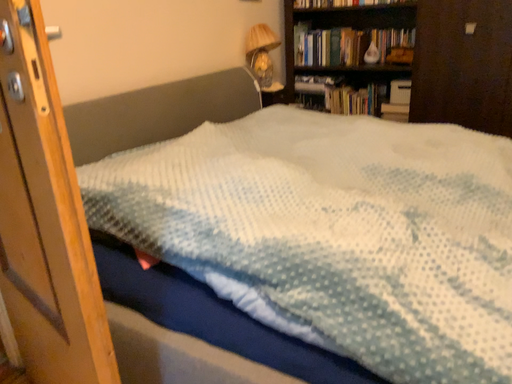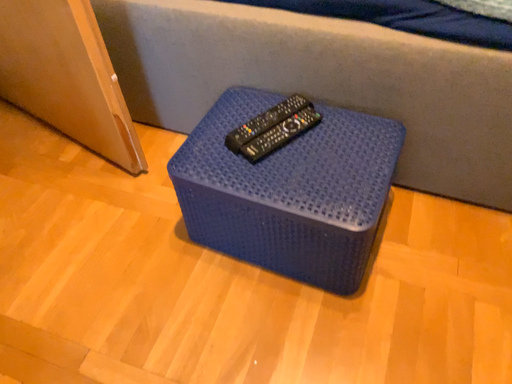
Question: Which way did the camera rotate in the video?

Choices:
 (A) rotated upward
 (B) rotated downward

Answer: (B)